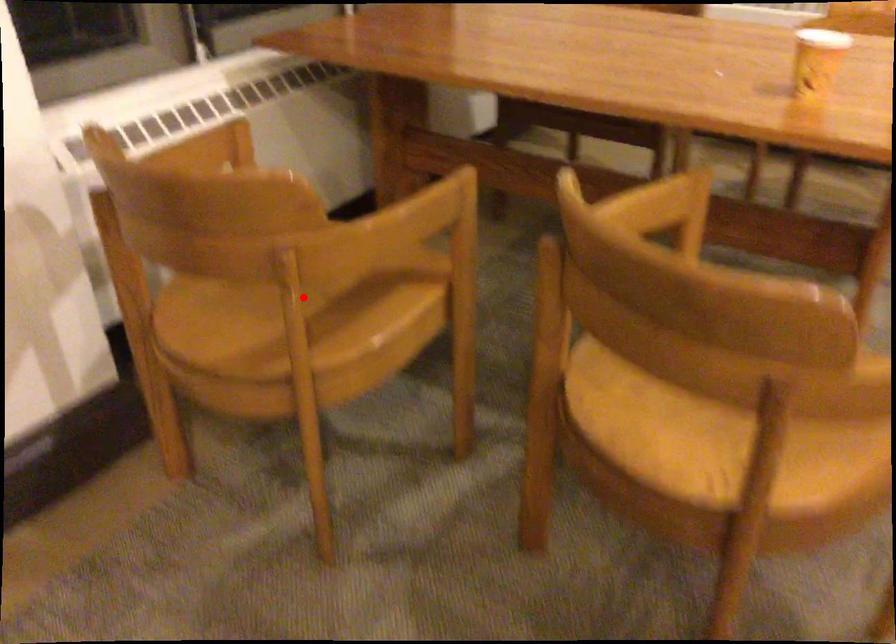
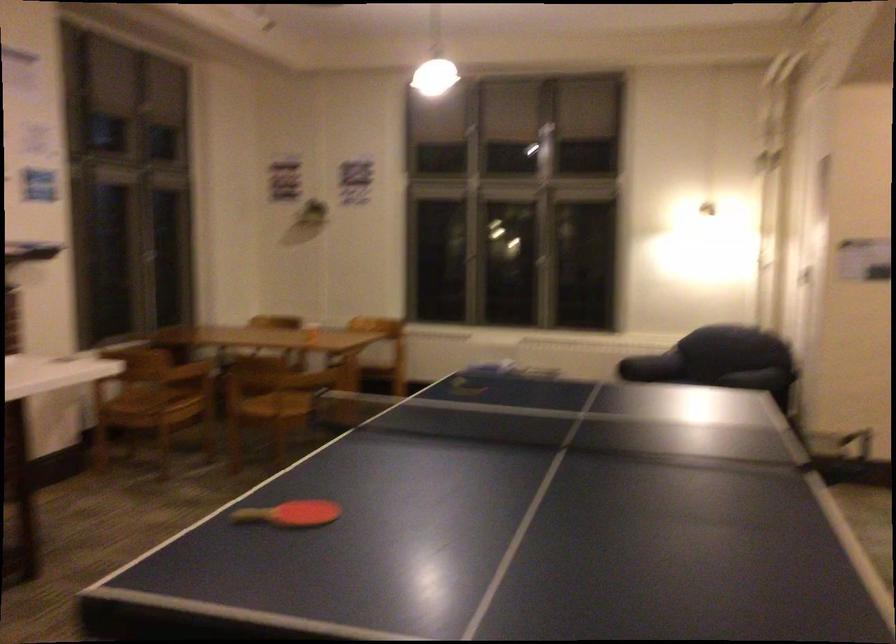
Question: I am providing you with two images of the same scene from different viewpoints. A red point is marked on the first image. At the location where the point appears in image 1, is it still visible in image 2?

Choices:
 (A) Yes
 (B) No

Answer: (B)